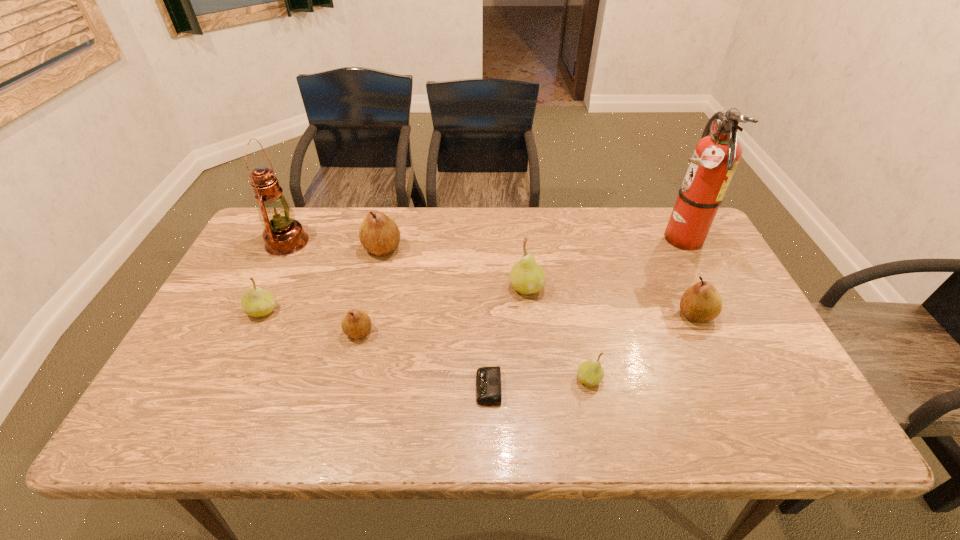
Locate an element on the screen. free space at the near edge is located at coordinates (381, 416).

Find the location of `free space at the left edge of the desktop`. free space at the left edge of the desktop is located at coordinates (274, 270).

Locate an element on the screen. free spot at the right edge of the desktop is located at coordinates (701, 335).

Identify the location of free space at the far left corner of the desktop. (299, 209).

In the image, there is a desktop. Where is `free region at the near right corner`? free region at the near right corner is located at coordinates (804, 441).

Find the location of `empty location between the biggest brown pear and the alarm clock`. empty location between the biggest brown pear and the alarm clock is located at coordinates (436, 318).

The height and width of the screenshot is (540, 960). I want to click on unoccupied area between the second green pear from right to left and the red fire extinguisher, so click(x=602, y=263).

Find the location of `free space that is in between the farthest pear and the fourth object from right to left`. free space that is in between the farthest pear and the fourth object from right to left is located at coordinates (454, 268).

Locate an element on the screen. The image size is (960, 540). free spot between the shortest object and the leftmost pear is located at coordinates (375, 349).

Where is `free spot between the nearest green pear and the alarm clock`? free spot between the nearest green pear and the alarm clock is located at coordinates (539, 383).